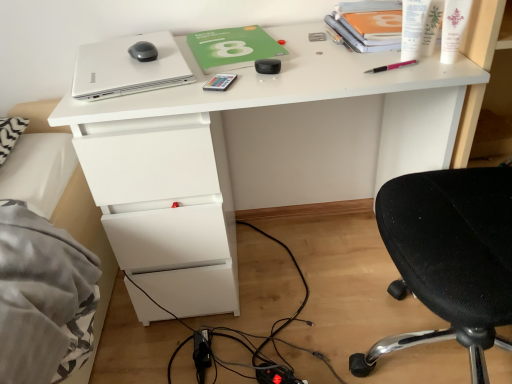
Locate an element on the screen. Image resolution: width=512 pixels, height=384 pixels. vacant area to the left of white glossy cream at upper right is located at coordinates (374, 65).